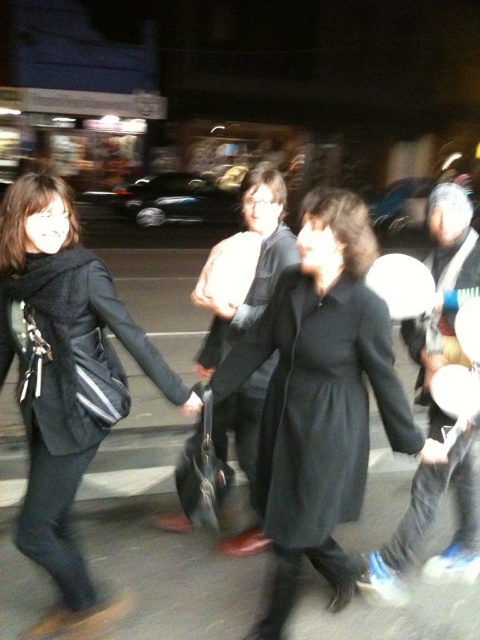
In the scene shown: Which is more to the right, black matte coat at center or white matte hat at center?

Positioned to the right is white matte hat at center.

Is point (352, 204) behind point (464, 502)?

No, (352, 204) is in front of (464, 502).

The height and width of the screenshot is (640, 480). Describe the element at coordinates (321, 400) in the screenshot. I see `black matte coat at center` at that location.

Identify the location of black matte coat at center. The height and width of the screenshot is (640, 480). point(321,400).

Is black matte coat at center thinner than black fabric coat at center?

No.

Between point (276, 387) and point (252, 454), which one is positioned in front?

Positioned in front is point (276, 387).

Does point (349, 493) come in front of point (256, 204)?

Yes.

The height and width of the screenshot is (640, 480). I want to click on black matte coat at center, so click(321, 400).

Who is more forward, (310, 406) or (12, 272)?

Point (310, 406) is more forward.

Which is behind, point (359, 316) or point (80, 595)?

The point (80, 595) is more distant.

Which is behind, point (249, 369) or point (68, 362)?

Point (249, 369)

Identify the location of black matte coat at center. The image size is (480, 640). (321, 400).